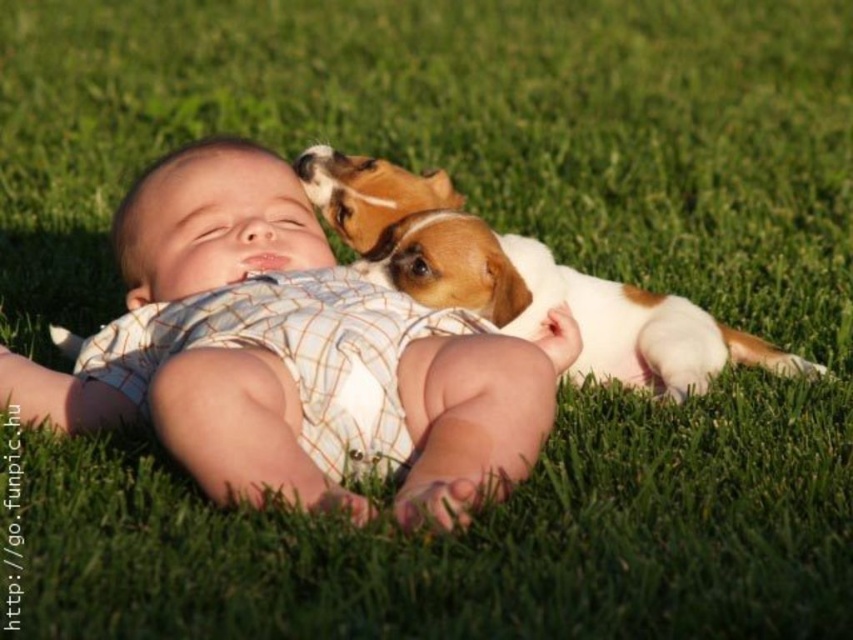
Is point (194, 161) positioned behind point (444, 250)?

That is True.

Where is `matte white baby at center`? matte white baby at center is located at coordinates (293, 355).